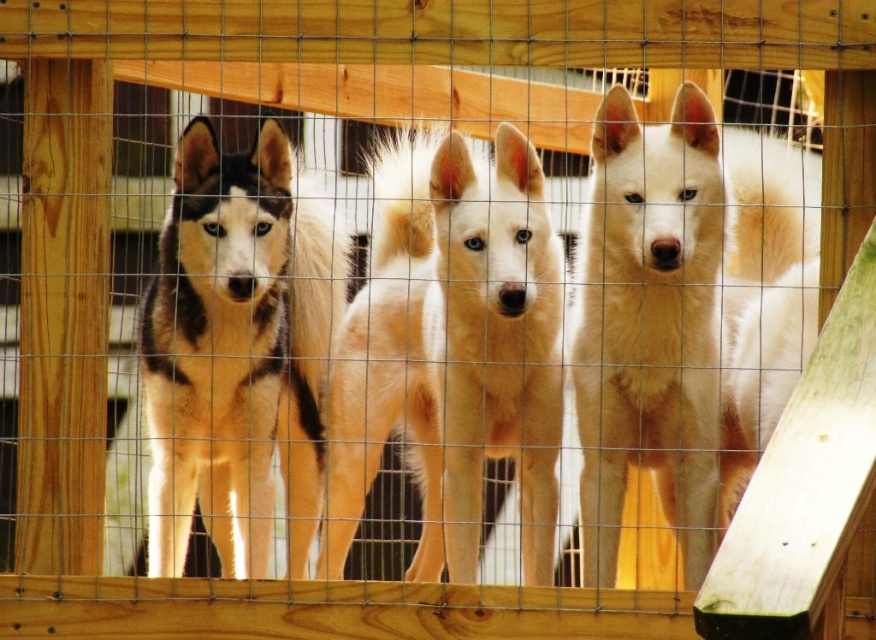
Is light brown fur at center positioned at the back of black and white fur at center?

That is False.

Does point (537, 492) lie in front of point (159, 352)?

That is False.

Is point (429, 371) less distant than point (206, 493)?

Yes, point (429, 371) is closer to viewer.

Where is `light brown fur at center`? Image resolution: width=876 pixels, height=640 pixels. light brown fur at center is located at coordinates (451, 349).

Can you confirm if light brown fur at center is wider than white fluffy dog at center?

No.

Is light brown fur at center above white fluffy dog at center?

No.

The image size is (876, 640). I want to click on light brown fur at center, so click(x=451, y=349).

Image resolution: width=876 pixels, height=640 pixels. What are the coordinates of `light brown fur at center` in the screenshot? It's located at (451, 349).

Does white fluffy dog at center lie behind black and white fur at center?

No, it is not.

Based on the photo, is white fluffy dog at center to the left of black and white fur at center from the viewer's perspective?

Incorrect, white fluffy dog at center is not on the left side of black and white fur at center.

Measure the distance between white fluffy dog at center and camera.

white fluffy dog at center is 4.06 meters away from camera.

What are the coordinates of `white fluffy dog at center` in the screenshot? It's located at (675, 310).